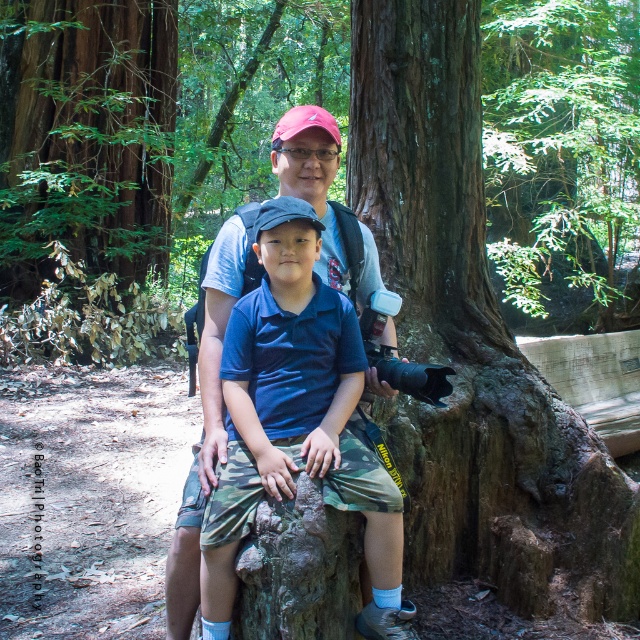
Is brown rough tree trunk at center in front of green rough bark tree at upper left?

Yes, brown rough tree trunk at center is in front of green rough bark tree at upper left.

Between point (433, 179) and point (26, 294), which one is positioned behind?

Positioned behind is point (26, 294).

At what (x,y) coordinates should I click in order to perform the action: click on brown rough tree trunk at center. Please return your answer as a coordinate pair (x, y). This screenshot has width=640, height=640. Looking at the image, I should click on (472, 339).

Consider the image. Does brown rough tree trunk at center appear over green leafy tree at upper center?

Incorrect, brown rough tree trunk at center is not positioned above green leafy tree at upper center.

Is point (417, 193) farther from camera compared to point (513, 26)?

No, it is in front of (513, 26).

Is point (412, 195) farther from camera compared to point (534, 173)?

No, it is not.

I want to click on brown rough tree trunk at center, so click(472, 339).

How much distance is there between brown rough tree trunk at center and camo shorts at center?

brown rough tree trunk at center and camo shorts at center are 37.57 inches apart from each other.

Can you confirm if brown rough tree trunk at center is positioned to the right of camo shorts at center?

Indeed, brown rough tree trunk at center is positioned on the right side of camo shorts at center.

Is point (358, 189) farther from camera compared to point (289, 486)?

Yes, it is behind point (289, 486).

Identify the location of brown rough tree trunk at center. The image size is (640, 640). (472, 339).